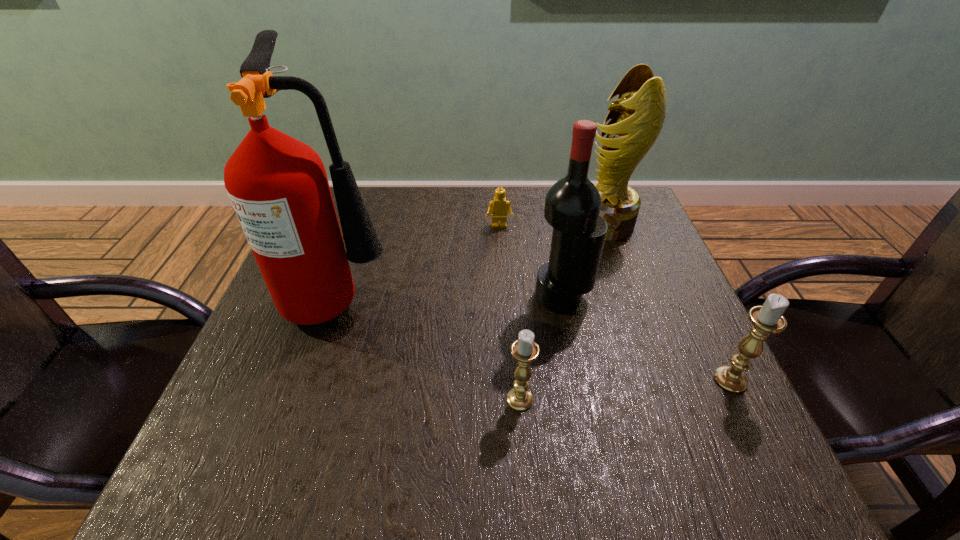
Find the location of a particular element. free point that keeps the candle holders evenly spaced on the left is located at coordinates (293, 420).